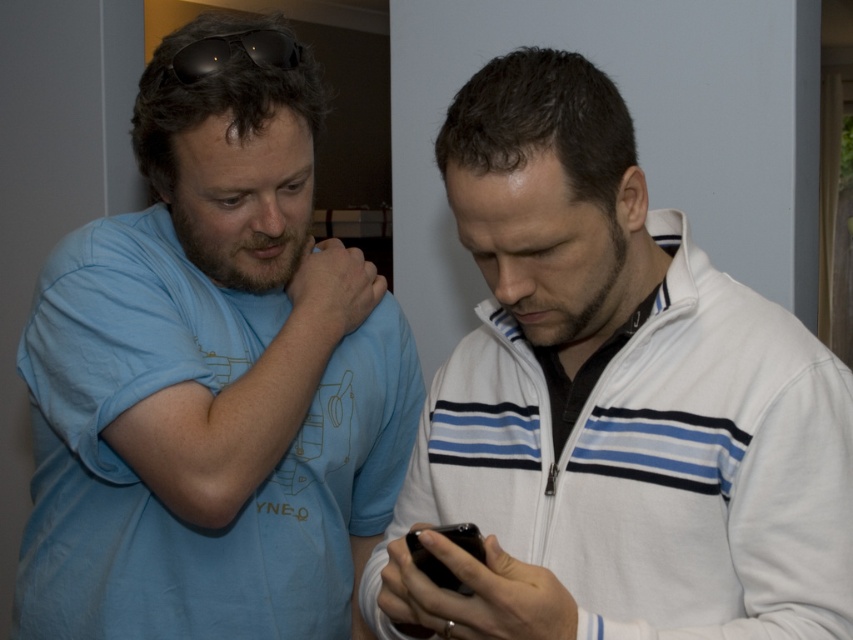
In the image, there are two people. The person on the left is wearing a light blue T shirt with YNEO graphic and the person on the right is wearing a white zip up jacket with horizontal stripes. There is a point at (x=612, y=403). Can you tell me what object is located at that coordinate?

The white fleece jacket at center is represented by point (x=612, y=403).

You are designing a display case for a clothing store. The display case needs to accommodate both the white fleece jacket at center and the black matte sunglasses at upper center. Given their sizes, which item should be placed in the larger compartment of the display case?

The white fleece jacket at center has a larger size compared to the black matte sunglasses at upper center, so the larger compartment should be allocated for the white fleece jacket at center.